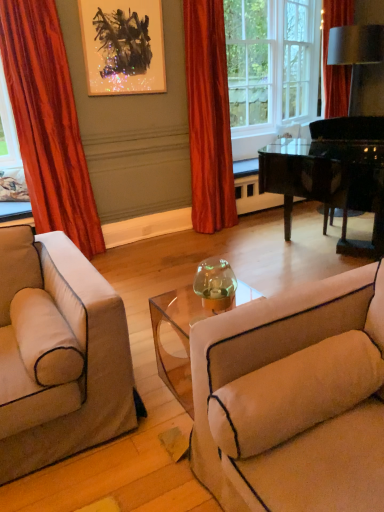
This screenshot has width=384, height=512. Identify the location of vacant area that lies to the right of velvet orange curtain at left, acting as the first curtain starting from the left. pos(130,264).